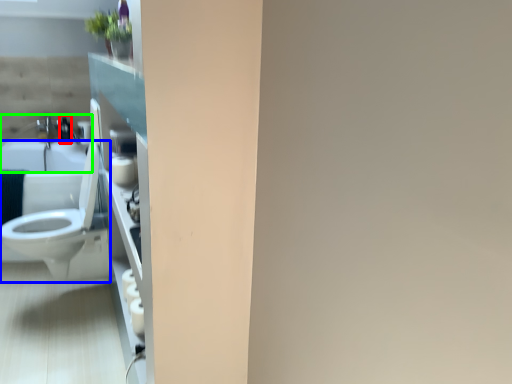
Question: Which is nearer to the toiletry (highlighted by a red box)? toilet (highlighted by a blue box) or sink (highlighted by a green box).

Choices:
 (A) toilet
 (B) sink

Answer: (B)